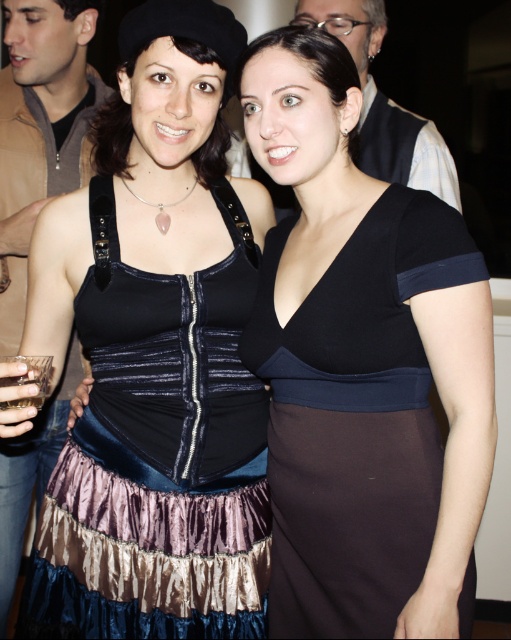
Question: Which of the following is the closest to the observer?

Choices:
 (A) (373, 470)
 (B) (78, 321)

Answer: (A)

Question: Which point is farther to the camera?

Choices:
 (A) velvet/ruffled dress at center
 (B) black matte dress at center

Answer: (A)

Question: Can you confirm if velvet/ruffled dress at center is positioned to the left of black matte dress at center?

Choices:
 (A) yes
 (B) no

Answer: (A)

Question: Is velvet/ruffled dress at center smaller than black matte dress at center?

Choices:
 (A) no
 (B) yes

Answer: (B)

Question: Observing the image, what is the correct spatial positioning of velvet/ruffled dress at center in reference to black matte dress at center?

Choices:
 (A) above
 (B) below

Answer: (A)